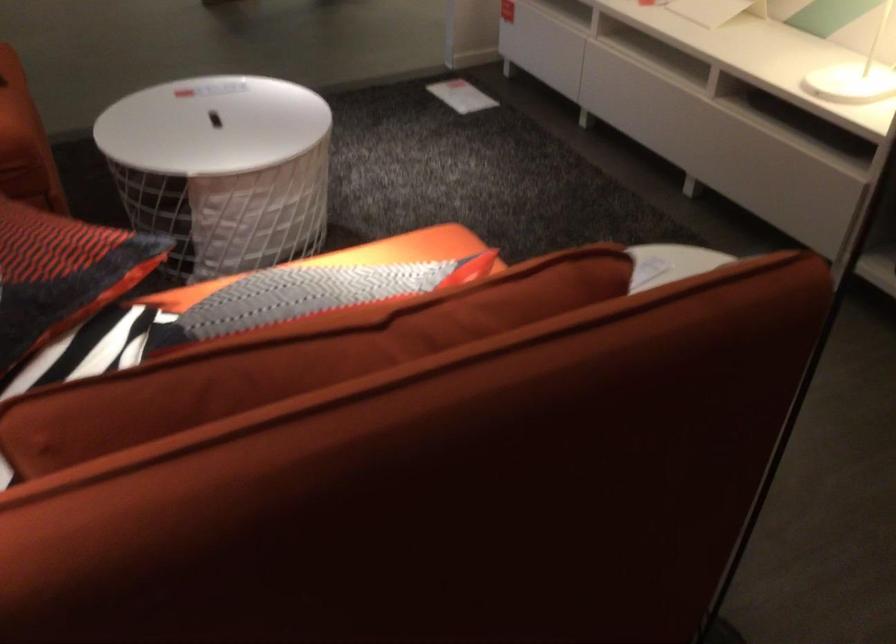
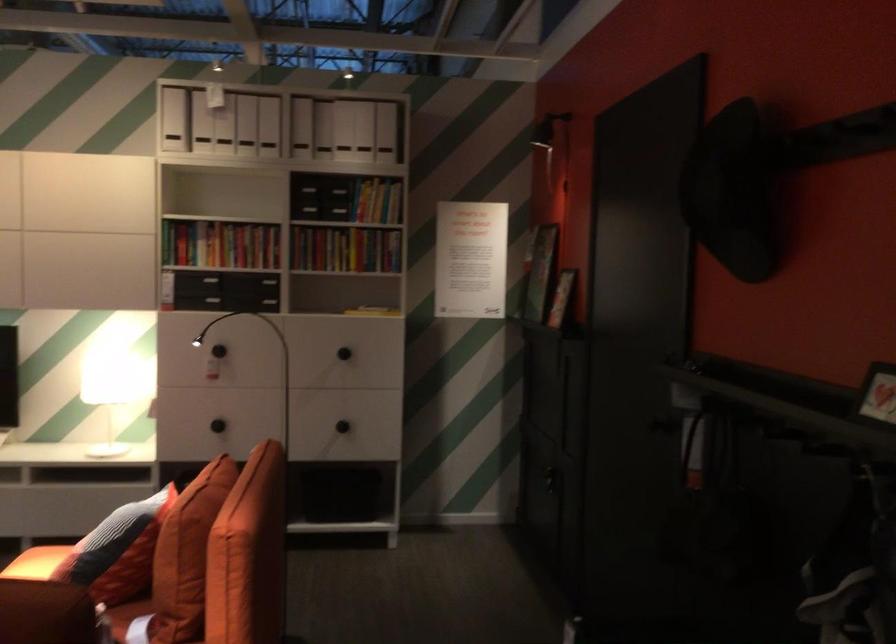
The point at (359, 256) is marked in the first image. Where is the corresponding point in the second image?

(36, 563)